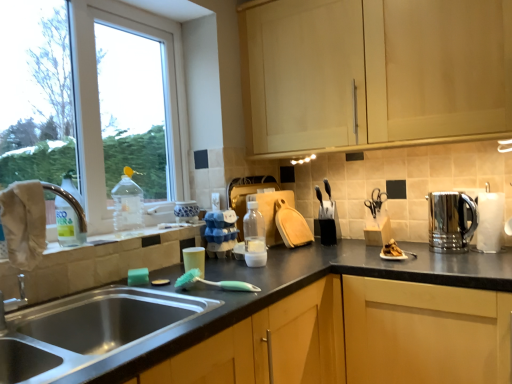
Question: Is polished stainless steel kettle at right, positioned as the third appliance in left-to-right order, facing away from green rubber brush at sink?

Choices:
 (A) yes
 (B) no

Answer: (B)

Question: Is the depth of polished stainless steel kettle at right, positioned as the third appliance in left-to-right order, greater than that of green rubber brush at sink?

Choices:
 (A) yes
 (B) no

Answer: (A)

Question: Does polished stainless steel kettle at right, positioned as the third appliance in left-to-right order, have a greater width compared to green rubber brush at sink?

Choices:
 (A) yes
 (B) no

Answer: (B)

Question: Is the position of polished stainless steel kettle at right, positioned as the third appliance in left-to-right order, less distant than that of green rubber brush at sink?

Choices:
 (A) no
 (B) yes

Answer: (A)

Question: Does polished stainless steel kettle at right, which is the first appliance in right-to-left order, appear on the right side of green rubber brush at sink?

Choices:
 (A) yes
 (B) no

Answer: (A)

Question: Considering the relative sizes of polished stainless steel kettle at right, which is the first appliance in right-to-left order, and green rubber brush at sink in the image provided, is polished stainless steel kettle at right, which is the first appliance in right-to-left order, smaller than green rubber brush at sink?

Choices:
 (A) no
 (B) yes

Answer: (A)

Question: From the image's perspective, is yellow matte window sill at lower left on beige fabric at sink left?

Choices:
 (A) yes
 (B) no

Answer: (B)

Question: Is yellow matte window sill at lower left wider than beige fabric at sink left?

Choices:
 (A) no
 (B) yes

Answer: (B)

Question: Is yellow matte window sill at lower left thinner than beige fabric at sink left?

Choices:
 (A) no
 (B) yes

Answer: (A)

Question: Is the surface of yellow matte window sill at lower left in direct contact with beige fabric at sink left?

Choices:
 (A) yes
 (B) no

Answer: (B)

Question: Is beige fabric at sink left a part of yellow matte window sill at lower left?

Choices:
 (A) no
 (B) yes

Answer: (A)

Question: Does yellow matte window sill at lower left have a larger size compared to beige fabric at sink left?

Choices:
 (A) no
 (B) yes

Answer: (B)

Question: Is stainless steel sink at lower left oriented towards black plastic knife block at upper right, the 2th appliance from the right?

Choices:
 (A) no
 (B) yes

Answer: (A)